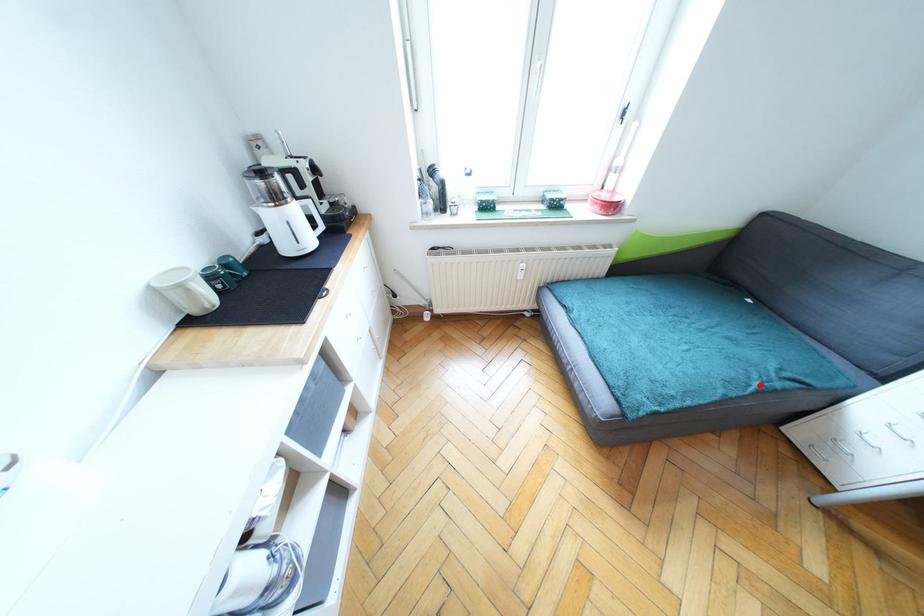
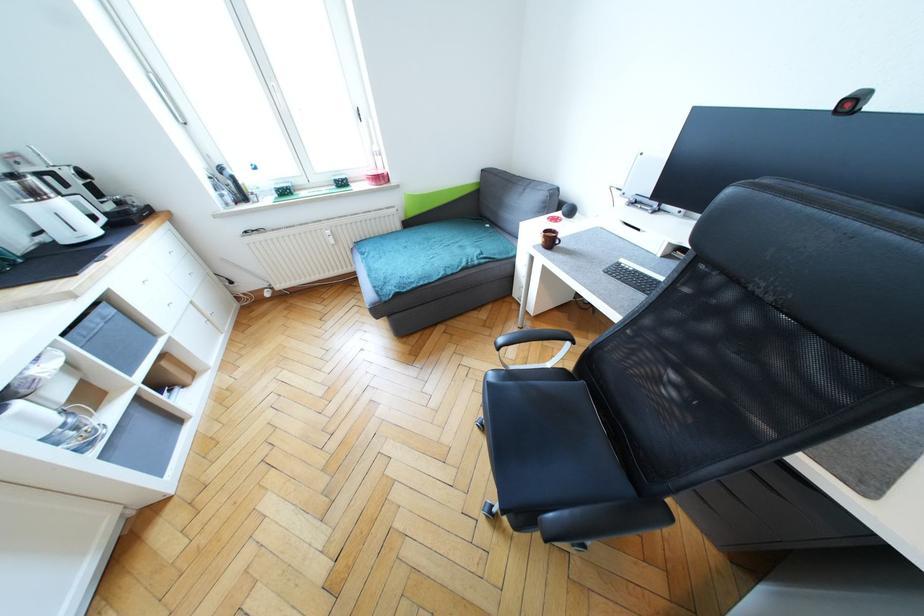
Locate, in the second image, the point that corresponds to the highlighted location in the first image.

(467, 265)